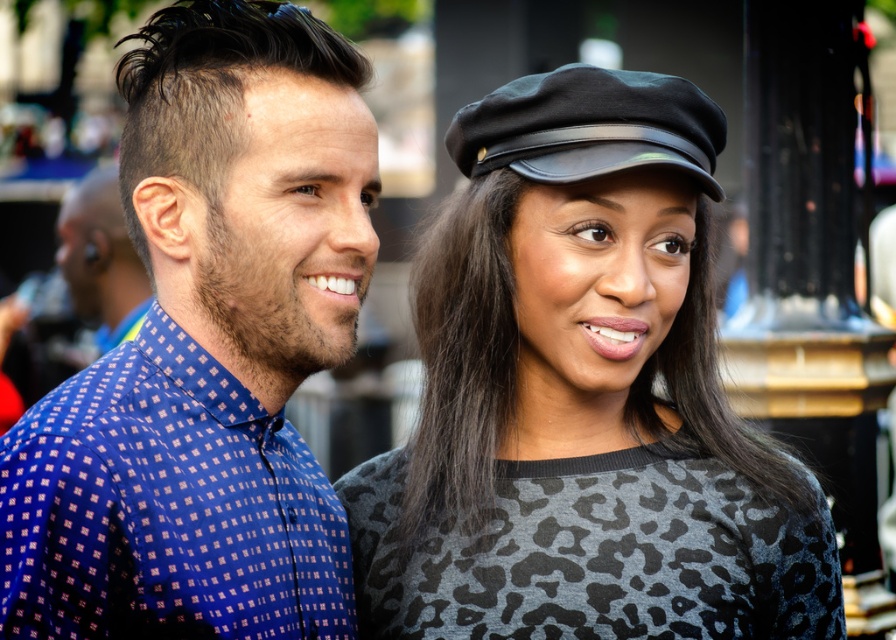
You are a photographer trying to capture a closeup of the leopard print sweater at center. You are currently standing at the point marked by coordinates point (x=582, y=397). Which direction should you move to get a better shot of the leopard print sweater at center?

The point marked by coordinates point (x=582, y=397) is already at the center of the leopard print sweater at center, so you don not need to move. You can take the photo from your current position.

You are a photographer trying to capture a clear shot of the leopard print sweater at center. You are currently standing 10 meters away from it. Can you move closer to get a better photo?

The leopard print sweater at center is 16.44 meters from the camera. Since you are currently 10 meters away, you can move 6.44 meters closer to reach the sweater and get a better photo.

In the scene shown: You are a photographer at an event and need to ensure both the leopard print sweater at center and the blue printed shirt at left are visible in a photo. Which clothing item should you focus on first to frame the shot properly?

The leopard print sweater at center is taller than the blue printed shirt at left, so you should focus on the leopard print sweater at center first to ensure it fits within the frame.